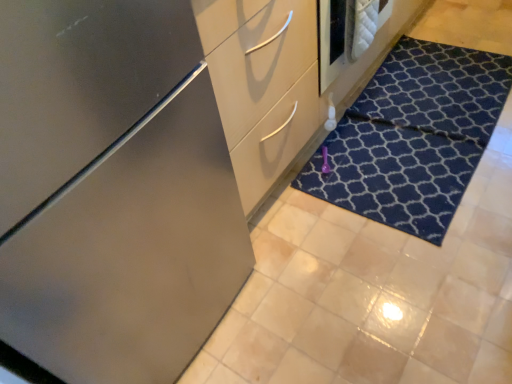
Question: Considering the relative positions of satin finish dresser at center and dark blue textured doormat at lower right in the image provided, is satin finish dresser at center behind dark blue textured doormat at lower right?

Choices:
 (A) yes
 (B) no

Answer: (B)

Question: Is satin finish dresser at center not close to dark blue textured doormat at lower right?

Choices:
 (A) yes
 (B) no

Answer: (B)

Question: Can you confirm if satin finish dresser at center is shorter than dark blue textured doormat at lower right?

Choices:
 (A) no
 (B) yes

Answer: (A)

Question: Is dark blue textured doormat at lower right at the back of satin finish dresser at center?

Choices:
 (A) yes
 (B) no

Answer: (B)

Question: Is satin finish dresser at center surrounding dark blue textured doormat at lower right?

Choices:
 (A) no
 (B) yes

Answer: (A)

Question: Can you confirm if satin finish dresser at center is smaller than dark blue textured doormat at lower right?

Choices:
 (A) yes
 (B) no

Answer: (B)

Question: Is satin finish cabinet at center thinner than satin finish dresser at center?

Choices:
 (A) no
 (B) yes

Answer: (A)

Question: Is satin finish cabinet at center taller than satin finish dresser at center?

Choices:
 (A) yes
 (B) no

Answer: (A)

Question: Considering the relative positions of satin finish cabinet at center and satin finish dresser at center in the image provided, is satin finish cabinet at center to the right of satin finish dresser at center from the viewer's perspective?

Choices:
 (A) yes
 (B) no

Answer: (B)

Question: Is satin finish cabinet at center far from satin finish dresser at center?

Choices:
 (A) no
 (B) yes

Answer: (A)

Question: From the image's perspective, would you say satin finish cabinet at center is shown under satin finish dresser at center?

Choices:
 (A) no
 (B) yes

Answer: (B)

Question: Does satin finish cabinet at center have a greater width compared to satin finish dresser at center?

Choices:
 (A) no
 (B) yes

Answer: (B)

Question: Does dark blue textured doormat at lower right have a larger size compared to satin finish cabinet at center?

Choices:
 (A) no
 (B) yes

Answer: (A)